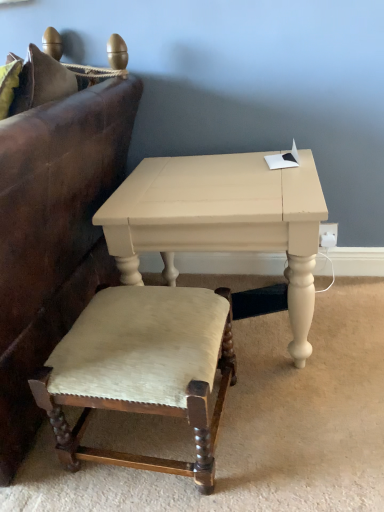
Question: Looking at the image, does matte white table at center seem bigger or smaller compared to velvet upholstered stool at lower left?

Choices:
 (A) small
 (B) big

Answer: (B)

Question: From a real-world perspective, is matte white table at center physically located above or below velvet upholstered stool at lower left?

Choices:
 (A) above
 (B) below

Answer: (A)

Question: Estimate the real-world distances between objects in this image. Which object is closer to the leather couch at left?

Choices:
 (A) matte white table at center
 (B) velvet upholstered stool at lower left

Answer: (A)

Question: Which is nearer to the leather couch at left?

Choices:
 (A) velvet upholstered stool at lower left
 (B) matte white table at center

Answer: (B)